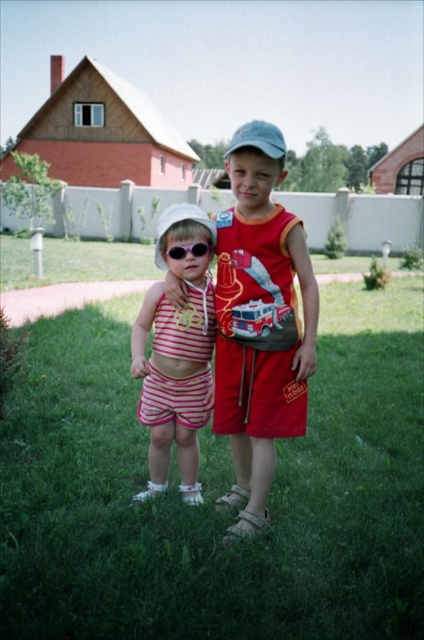
Question: Is matte red shorts at center positioned before blue fabric baseball cap at center?

Choices:
 (A) yes
 (B) no

Answer: (A)

Question: Does striped cotton tank top at center have a greater width compared to striped cotton dress at center?

Choices:
 (A) no
 (B) yes

Answer: (B)

Question: Based on their relative distances, which object is farther from the matte black sunglasses at center?

Choices:
 (A) green grass at center
 (B) white fabric baseball hat at center

Answer: (A)

Question: Which is nearer to the blue fabric baseball cap at center?

Choices:
 (A) matte red shorts at center
 (B) matte black sunglasses at center
 (C) striped cotton dress at center

Answer: (B)

Question: Can you confirm if green grass at center is bigger than blue fabric baseball cap at center?

Choices:
 (A) no
 (B) yes

Answer: (A)

Question: Among these objects, which one is nearest to the camera?

Choices:
 (A) white fabric baseball hat at center
 (B) green grass at center

Answer: (B)